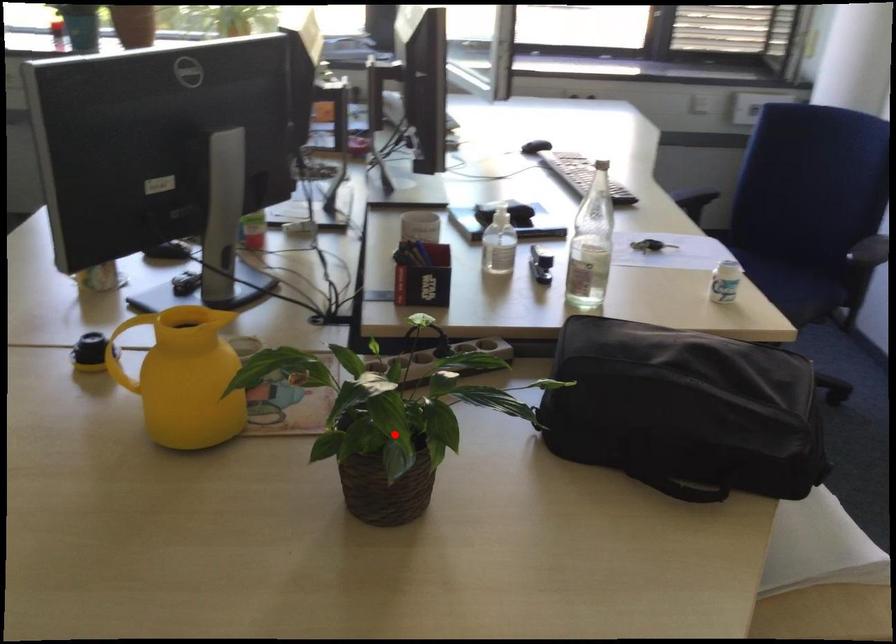
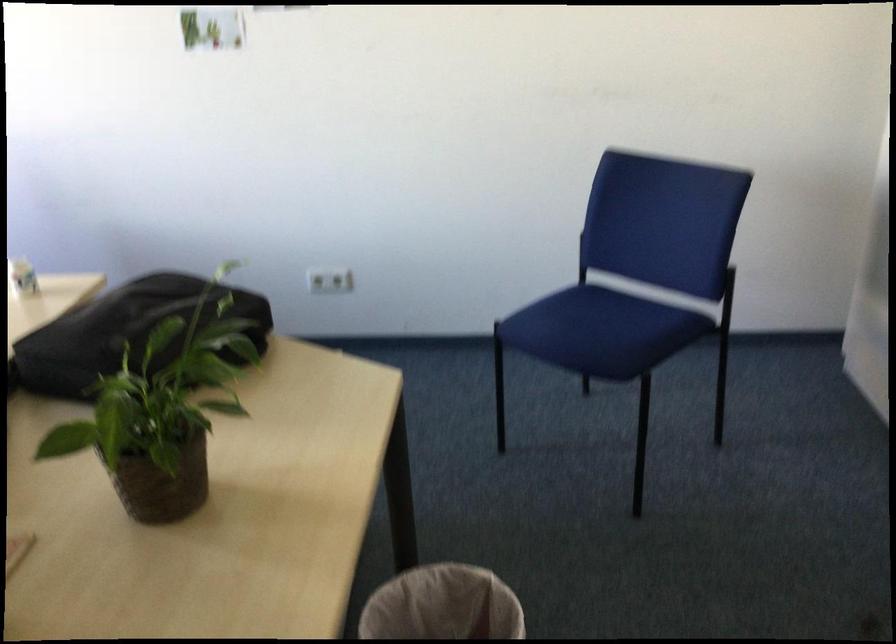
Question: I am providing you with two images of the same scene from different viewpoints. Given a red point in image1, look at the same physical point in image2. Is it:

Choices:
 (A) Closer to the viewpoint
 (B) Farther from the viewpoint

Answer: (B)